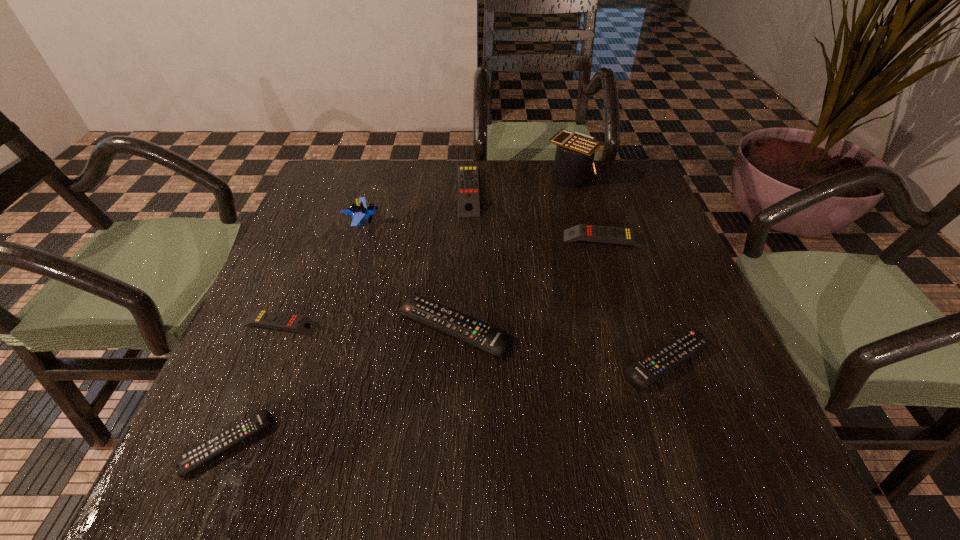
Locate an element on the screen. Image resolution: width=960 pixels, height=540 pixels. the nearest yellow remote control is located at coordinates (263, 318).

I want to click on the shortest object, so click(x=193, y=458).

Identify the location of the nearest black remote control. point(193,458).

Image resolution: width=960 pixels, height=540 pixels. In order to click on vacant region located on the left of the tallest object in this screenshot , I will do `click(445, 176)`.

You are a GUI agent. You are given a task and a screenshot of the screen. Output one action in this format:
    pyautogui.click(x=<x>, y=<y>)
    Task: Click on the vacant space located on the front-facing side of the second tallest object
    Image resolution: width=960 pixels, height=540 pixels.
    Given the screenshot: What is the action you would take?
    click(437, 222)

Where is `free location located on the right of the biggest yellow remote control`? The width and height of the screenshot is (960, 540). free location located on the right of the biggest yellow remote control is located at coordinates (553, 190).

Where is `free space located on the front of the rightmost yellow remote control`? Image resolution: width=960 pixels, height=540 pixels. free space located on the front of the rightmost yellow remote control is located at coordinates (636, 343).

Locate an element on the screen. vacant area located on the back of the second black remote control from left to right is located at coordinates [x=459, y=222].

This screenshot has height=540, width=960. I want to click on vacant position located on the left of the rightmost black remote control, so click(x=462, y=360).

This screenshot has width=960, height=540. I want to click on vacant space situated 0.390m on the back of the smallest yellow remote control, so [331, 201].